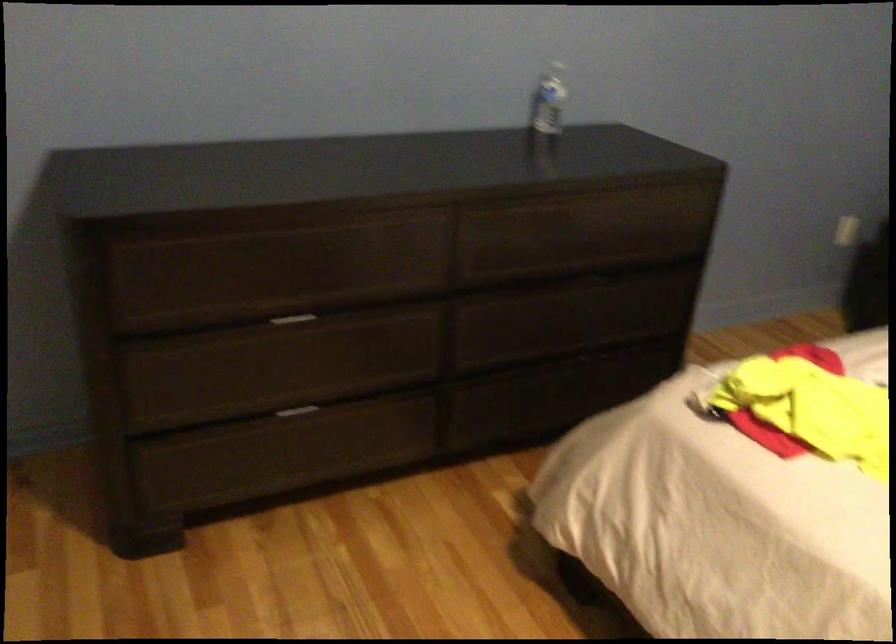
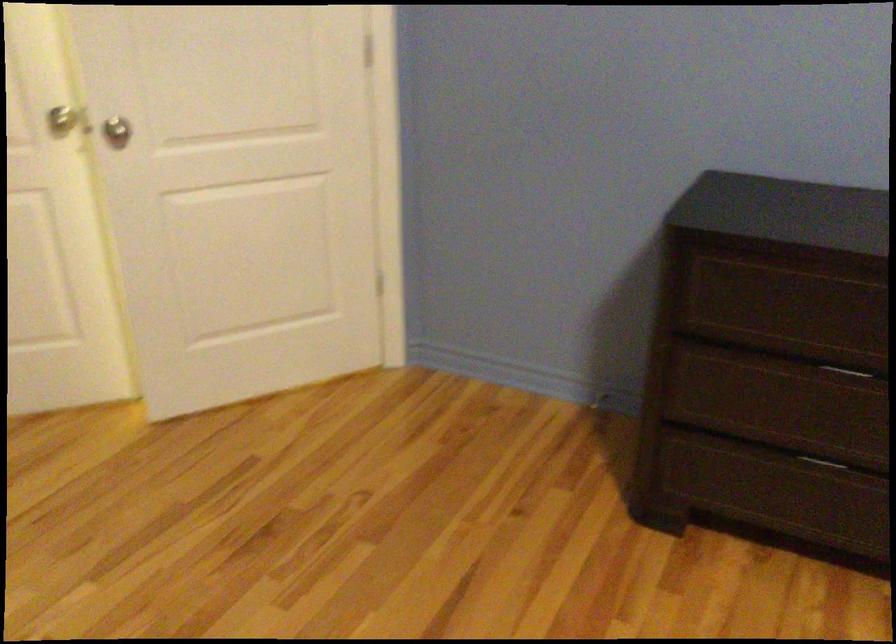
Find the pixel in the second image that matches point 282,322 in the first image.

(850, 371)